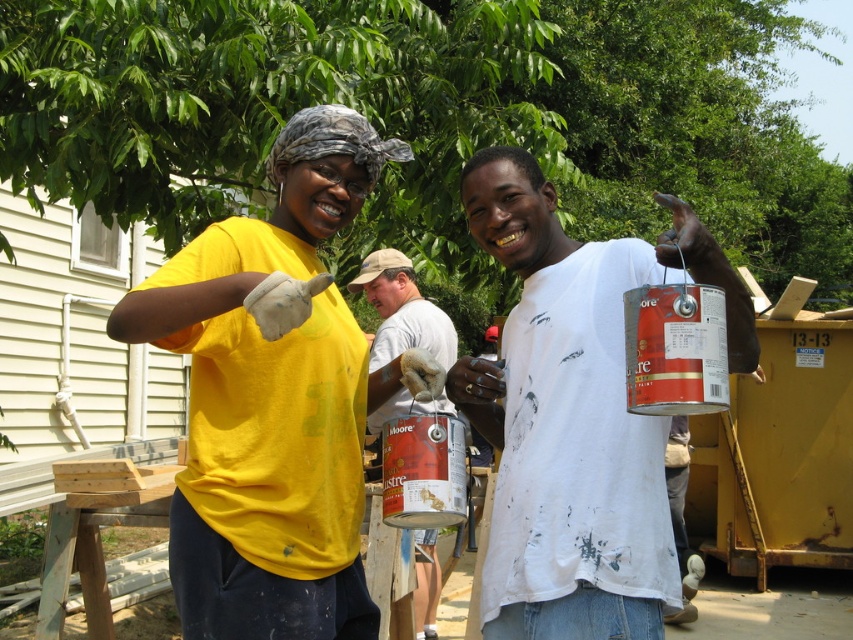
Question: In this image, where is yellow fabric shirt at upper left located relative to matte gray shirt at center?

Choices:
 (A) left
 (B) right

Answer: (A)

Question: Is yellow fabric shirt at upper left thinner than white matte paint can at center?

Choices:
 (A) yes
 (B) no

Answer: (B)

Question: Is yellow fabric shirt at upper left in front of white matte paint can at center?

Choices:
 (A) no
 (B) yes

Answer: (B)

Question: Which of the following is the farthest from the observer?

Choices:
 (A) white matte paint can at center
 (B) matte gray shirt at center
 (C) yellow fabric shirt at upper left

Answer: (B)

Question: Estimate the real-world distances between objects in this image. Which object is farther from the yellow fabric shirt at upper left?

Choices:
 (A) white matte paint can at center
 (B) matte gray shirt at center

Answer: (B)

Question: Which object is closer to the camera taking this photo?

Choices:
 (A) matte gray shirt at center
 (B) white matte paint can at center

Answer: (B)